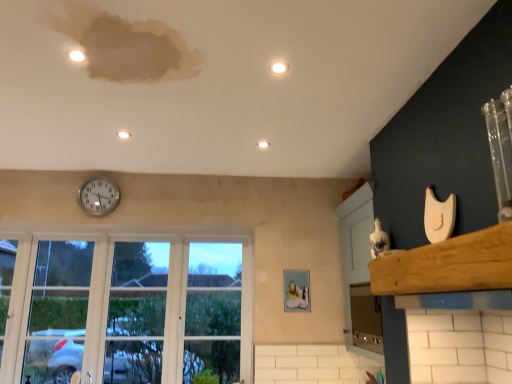
Question: Does silver metallic clock at upper center appear on the left side of white glossy light at center, the 1th light positioned from the back?

Choices:
 (A) no
 (B) yes

Answer: (B)

Question: Is silver metallic clock at upper center next to white glossy light at center, which appears as the 2th light when viewed from the left?

Choices:
 (A) yes
 (B) no

Answer: (B)

Question: Is white glossy light at center, the 3th light in the top-to-bottom sequence, completely or partially inside silver metallic clock at upper center?

Choices:
 (A) yes
 (B) no

Answer: (B)

Question: Is silver metallic clock at upper center not within white glossy light at center, which appears as the 1th light when ordered from the bottom?

Choices:
 (A) no
 (B) yes

Answer: (B)

Question: From a real-world perspective, is silver metallic clock at upper center positioned under white glossy light at center, the 3th light in the top-to-bottom sequence, based on gravity?

Choices:
 (A) no
 (B) yes

Answer: (B)

Question: Is silver metallic clock at upper center in front of white glossy light at center, which appears as the 2th light when viewed from the left?

Choices:
 (A) yes
 (B) no

Answer: (B)

Question: Does clear glass window at lower left appear on the left side of satin silver oven at lower right?

Choices:
 (A) yes
 (B) no

Answer: (A)

Question: Can you confirm if clear glass window at lower left is positioned to the right of satin silver oven at lower right?

Choices:
 (A) no
 (B) yes

Answer: (A)

Question: Can you confirm if clear glass window at lower left is smaller than satin silver oven at lower right?

Choices:
 (A) no
 (B) yes

Answer: (A)

Question: From the image's perspective, is clear glass window at lower left below satin silver oven at lower right?

Choices:
 (A) no
 (B) yes

Answer: (B)

Question: Can you confirm if clear glass window at lower left is wider than satin silver oven at lower right?

Choices:
 (A) no
 (B) yes

Answer: (A)

Question: Can you confirm if clear glass window at lower left is bigger than satin silver oven at lower right?

Choices:
 (A) yes
 (B) no

Answer: (A)

Question: Is matte white light at upper center, placed as the 2th light when sorted from front to back, completely or partially inside silver metallic clock at upper center?

Choices:
 (A) yes
 (B) no

Answer: (B)